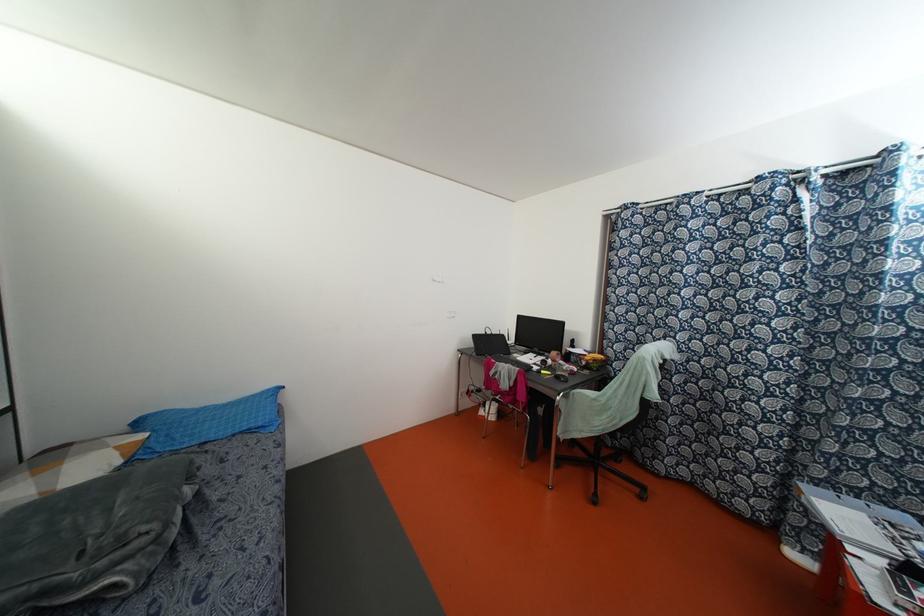
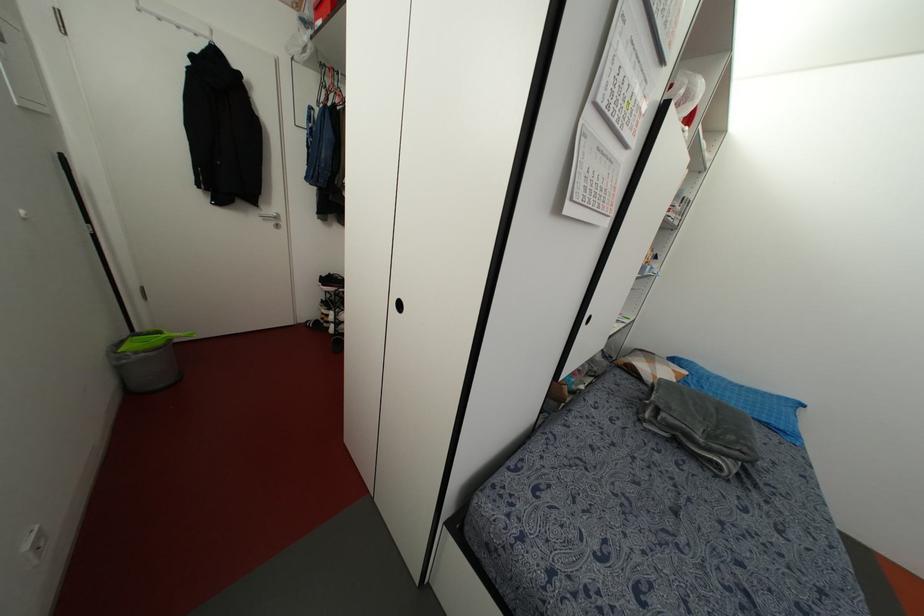
Find the pixel in the second image that matches (x=259, y=424) in the first image.

(782, 427)